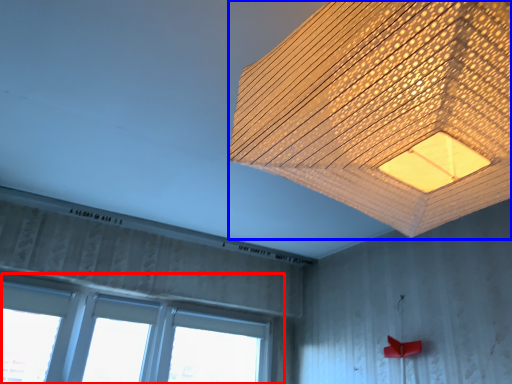
Question: Which of the following is the farthest to the observer, window (highlighted by a red box) or lamp (highlighted by a blue box)?

Choices:
 (A) window
 (B) lamp

Answer: (A)